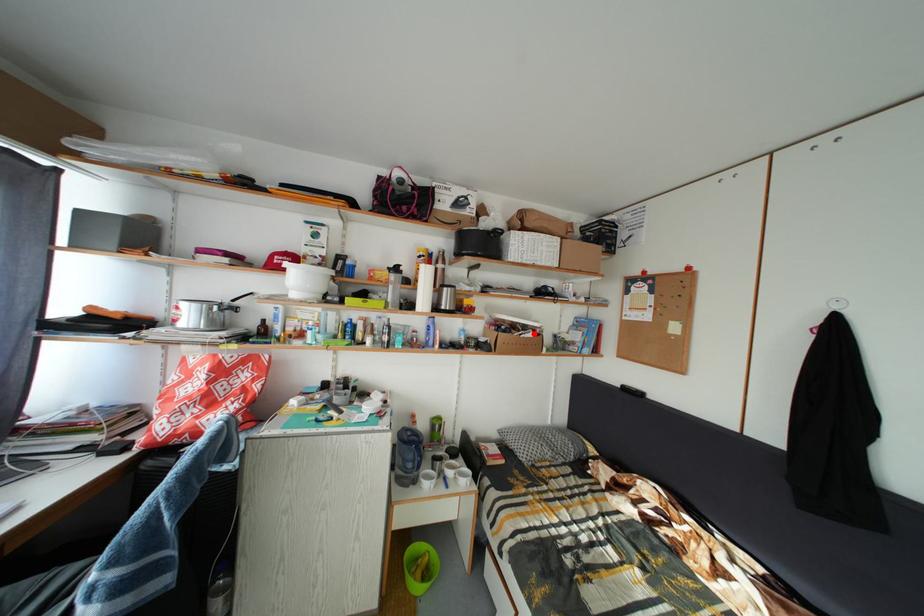
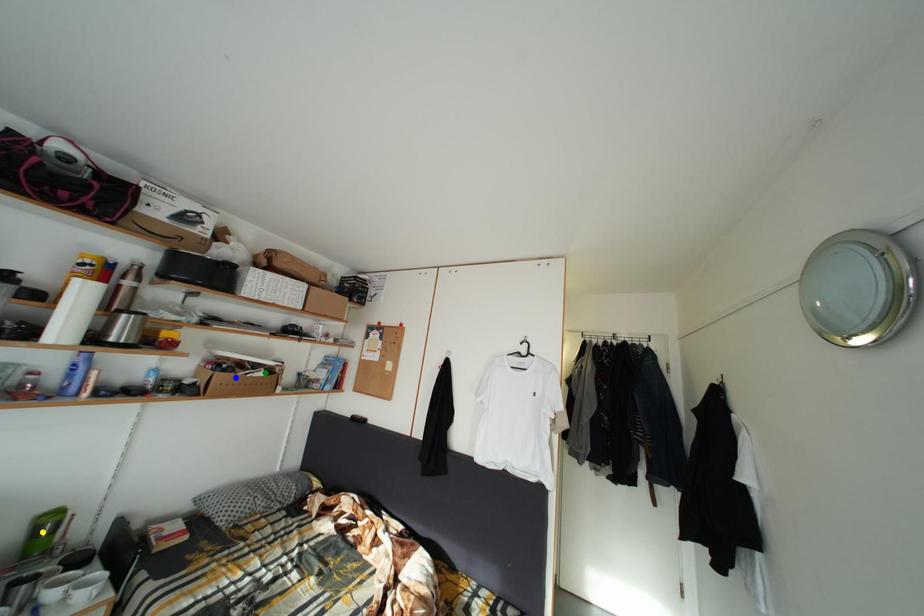
Question: I am providing you with two images of the same scene from different viewpoints. A red point is marked on the first image. You are given multiple points on the second image. Can you choose the point in image 2 that corresponds to the point in image 1?

Choices:
 (A) blue point
 (B) yellow point
 (C) green point

Answer: (C)